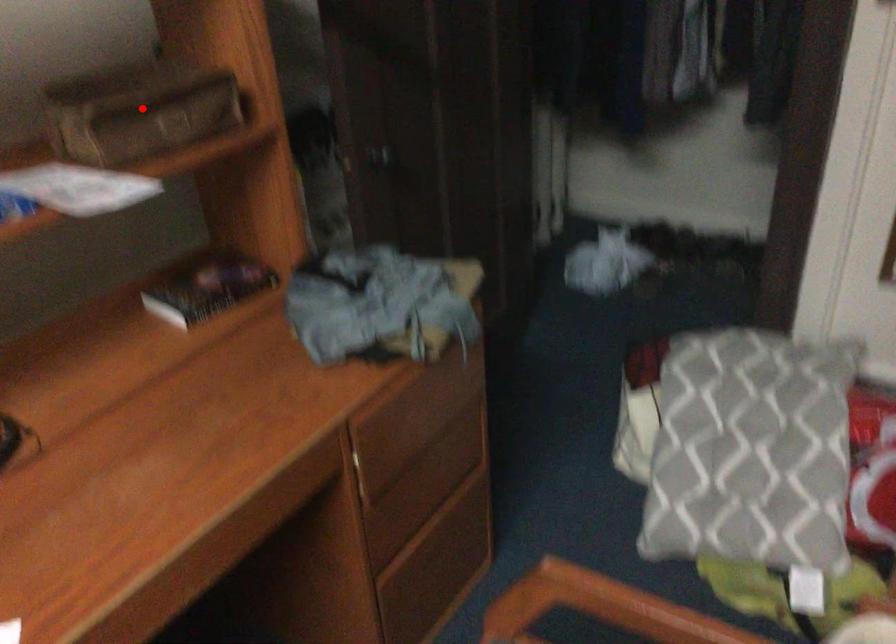
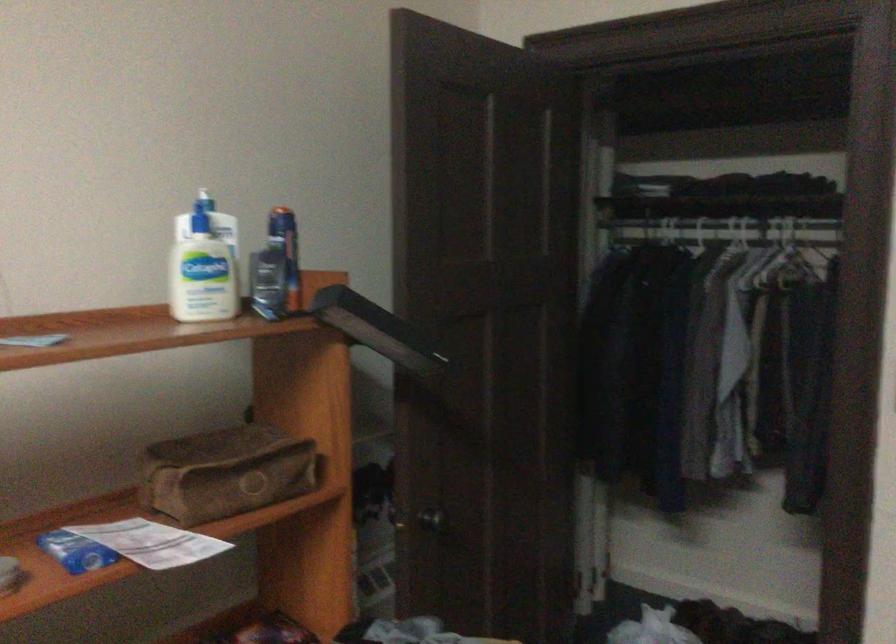
Question: I am providing you with two images of the same scene from different viewpoints. Image1 has a red point marked. In image2, the corresponding 3D location appears at what relative position? Reply with the corresponding letter.

Choices:
 (A) Closer
 (B) Farther

Answer: (B)